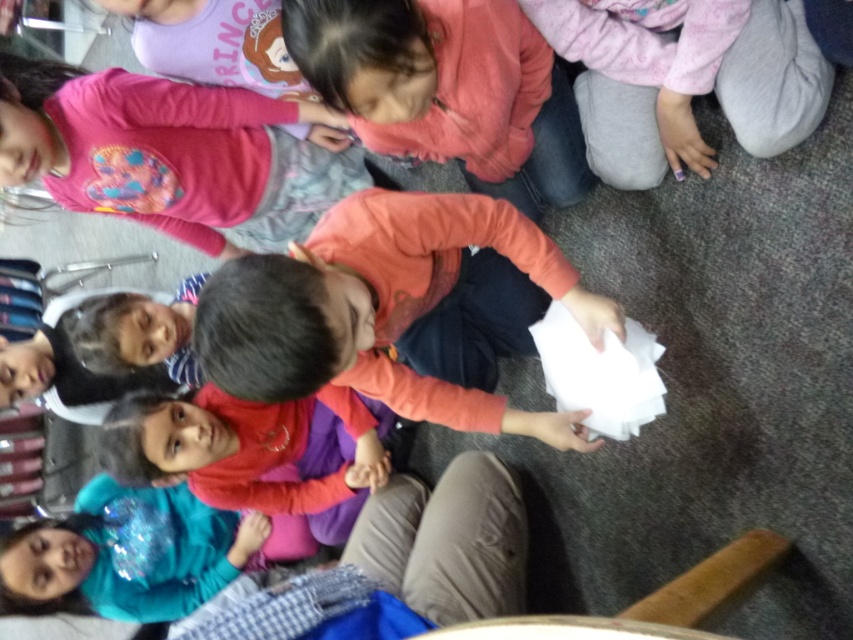
Question: From the image, what is the correct spatial relationship of matte pink shirt at center in relation to teal glitter shirt at lower left?

Choices:
 (A) left
 (B) right

Answer: (B)

Question: Which point appears closest to the camera in this image?

Choices:
 (A) (209, 99)
 (B) (270, 513)

Answer: (A)

Question: Which point is farther to the camera?

Choices:
 (A) matte pink sweater at center
 (B) pink fleece shirt at upper left

Answer: (B)

Question: Does matte pink shirt at center have a greater width compared to teal glitter shirt at lower left?

Choices:
 (A) no
 (B) yes

Answer: (B)

Question: Which object is closer to the camera taking this photo?

Choices:
 (A) pink fleece shirt at upper left
 (B) matte pink shirt at center
 (C) teal glitter shirt at lower left

Answer: (A)

Question: Does matte pink shirt at center have a larger size compared to teal glitter shirt at lower left?

Choices:
 (A) yes
 (B) no

Answer: (A)